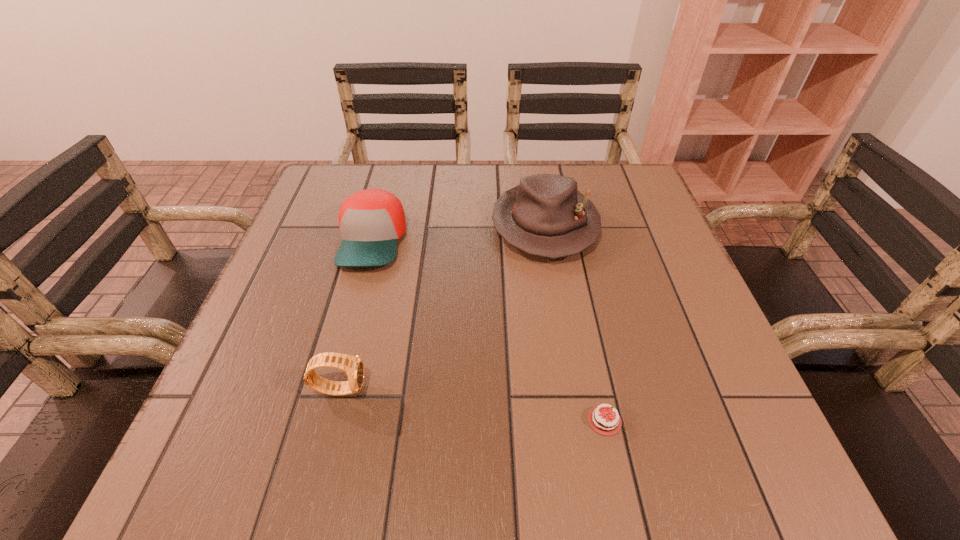
The width and height of the screenshot is (960, 540). I want to click on free region that satisfies the following two spatial constraints: 1. on the face of the chocolate cake; 2. on the right side of the watch, so pos(332,421).

Locate an element on the screen. The image size is (960, 540). free space that satisfies the following two spatial constraints: 1. on the decorative side of the hat; 2. on the face of the watch is located at coordinates (572, 388).

The height and width of the screenshot is (540, 960). I want to click on free space that satisfies the following two spatial constraints: 1. at the brim of the shortest object; 2. on the right side of the baseball cap, so click(324, 421).